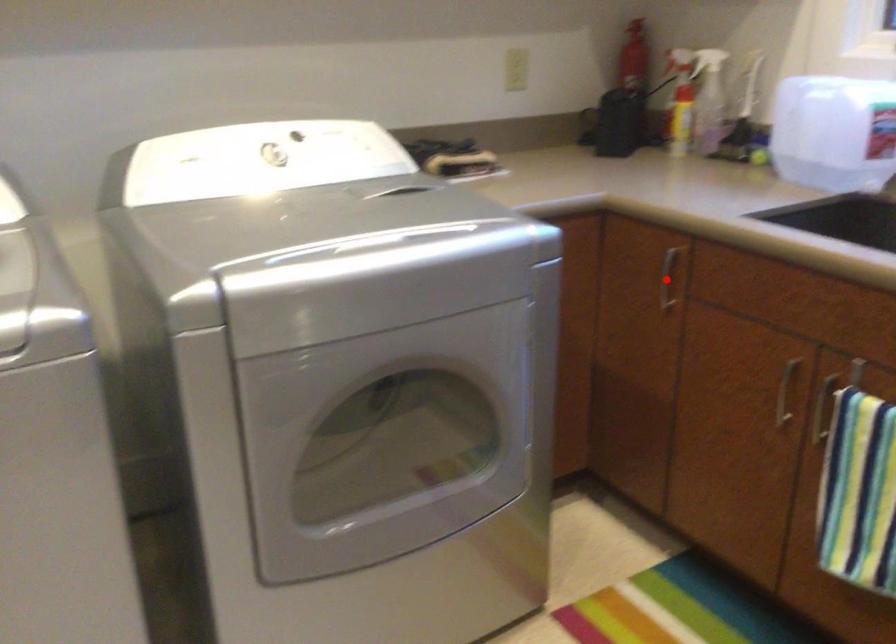
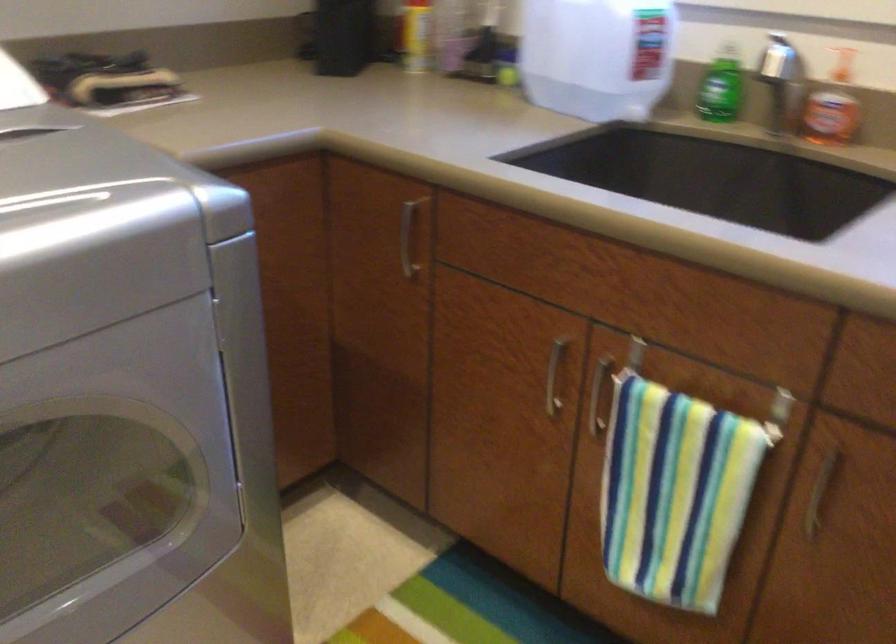
In the second image, find the point that corresponds to the highlighted location in the first image.

(407, 238)